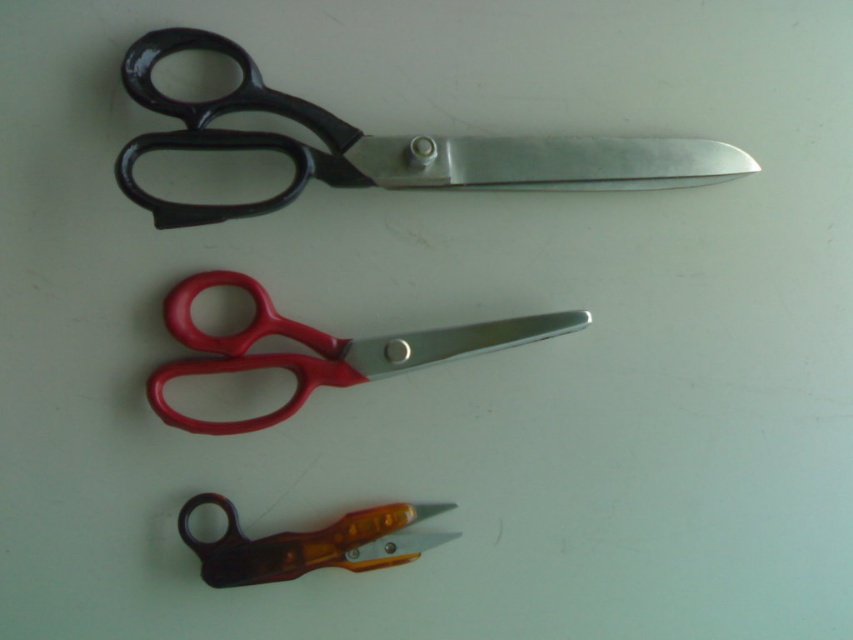
Can you confirm if black metallic scissors at upper center is wider than red plastic scissors at center?

Yes, black metallic scissors at upper center is wider than red plastic scissors at center.

Locate an element on the screen. black metallic scissors at upper center is located at coordinates 386,147.

Is point (230, 275) positioned in front of point (202, 547)?

No, (230, 275) is further to viewer.

How distant is red plastic scissors at center from translucent orange plastic scissors at lower center?

red plastic scissors at center is 8.23 inches from translucent orange plastic scissors at lower center.

Who is more distant from viewer, [285,410] or [201,573]?

The point [285,410] is behind.

This screenshot has width=853, height=640. I want to click on red plastic scissors at center, so click(318, 349).

Does black metallic scissors at upper center come behind translucent orange plastic scissors at lower center?

No.

Can you confirm if black metallic scissors at upper center is thinner than translucent orange plastic scissors at lower center?

Incorrect, black metallic scissors at upper center's width is not less than translucent orange plastic scissors at lower center's.

Which is in front, point (287, 106) or point (352, 525)?

Point (287, 106) is more forward.

You are a GUI agent. You are given a task and a screenshot of the screen. Output one action in this format:
    pyautogui.click(x=<x>, y=<y>)
    Task: Click on the black metallic scissors at upper center
    The image size is (853, 640).
    Given the screenshot: What is the action you would take?
    pyautogui.click(x=386, y=147)